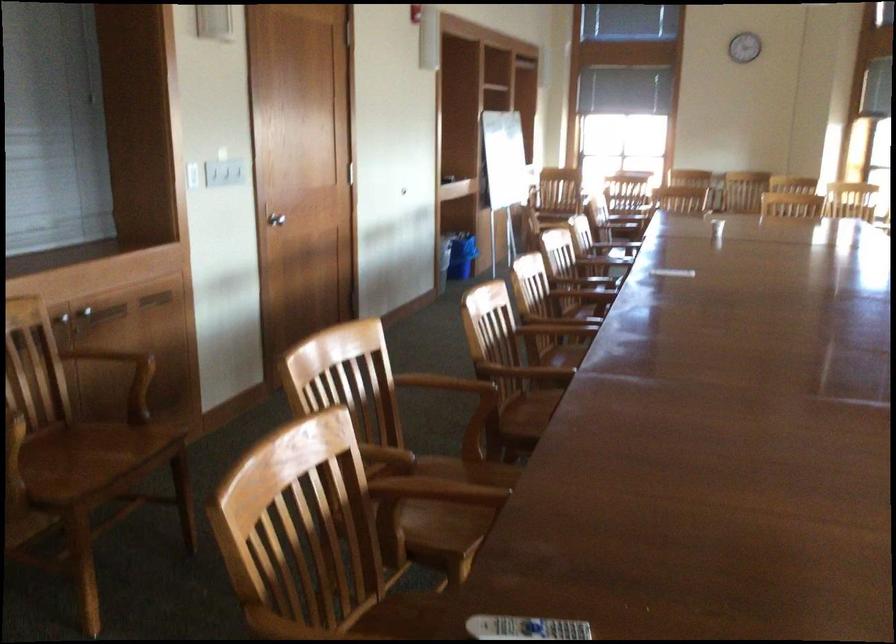
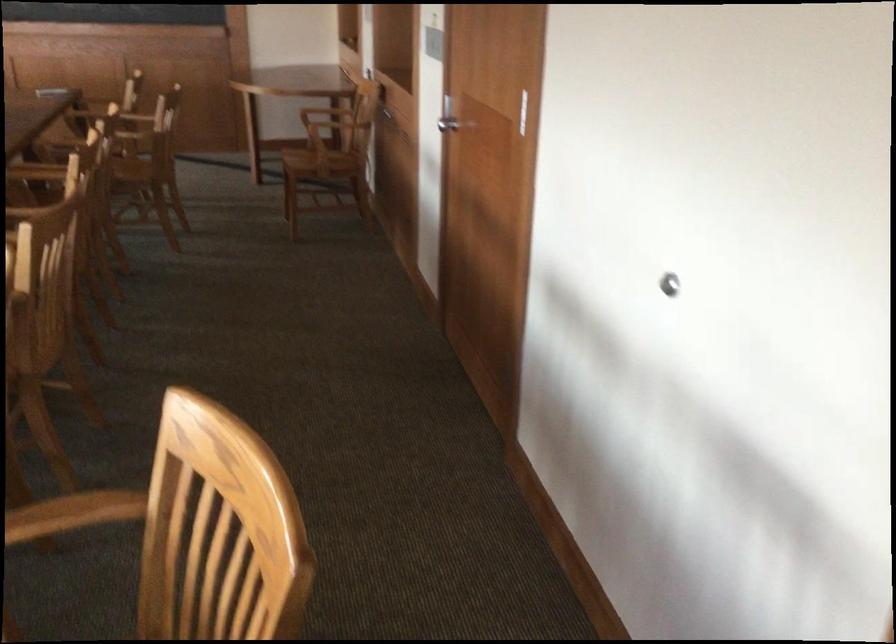
Question: I am providing you with two images of the same scene from different viewpoints. Please identify which objects are invisible in image2.

Choices:
 (A) grey sandal
 (B) cabinet handle
 (C) chair armrest
 (D) chair sitting surface

Answer: (B)